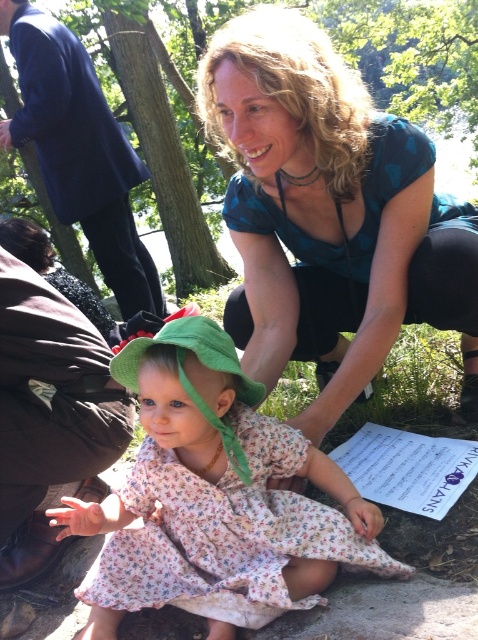
Question: Does blue printed dress at center appear on the right side of floral cotton dress at center?

Choices:
 (A) yes
 (B) no

Answer: (A)

Question: Can you confirm if blue printed dress at center is positioned below floral cotton dress at center?

Choices:
 (A) no
 (B) yes

Answer: (A)

Question: Among these points, which one is nearest to the camera?

Choices:
 (A) (86, 157)
 (B) (151, 508)
 (C) (248, 56)

Answer: (B)

Question: Which object is positioned farthest from the blue printed dress at center?

Choices:
 (A) dark blue fabric at upper left
 (B) floral cotton dress at center

Answer: (A)

Question: From the image, what is the correct spatial relationship of blue printed dress at center in relation to floral cotton dress at center?

Choices:
 (A) below
 (B) above

Answer: (B)

Question: Which point is farther to the camera?

Choices:
 (A) coord(194,538)
 (B) coord(21,120)
 (C) coord(315,349)

Answer: (B)